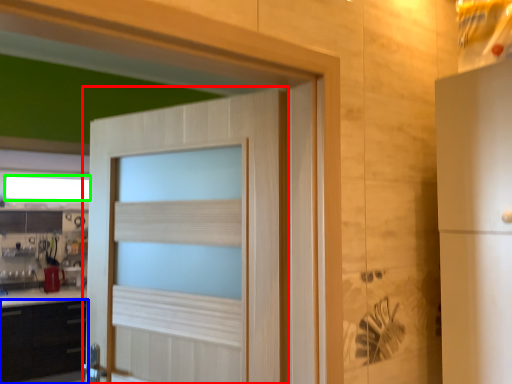
Question: Estimate the real-world distances between objects in this image. Which object is closer to door (highlighted by a red box), cabinetry (highlighted by a blue box) or window (highlighted by a green box)?

Choices:
 (A) cabinetry
 (B) window

Answer: (A)